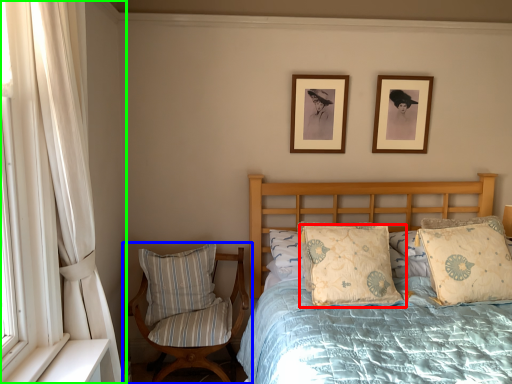
Question: Which object is the closest to the pillow (highlighted by a red box)? Choose among these: chair (highlighted by a blue box) or curtain (highlighted by a green box).

Choices:
 (A) chair
 (B) curtain

Answer: (A)